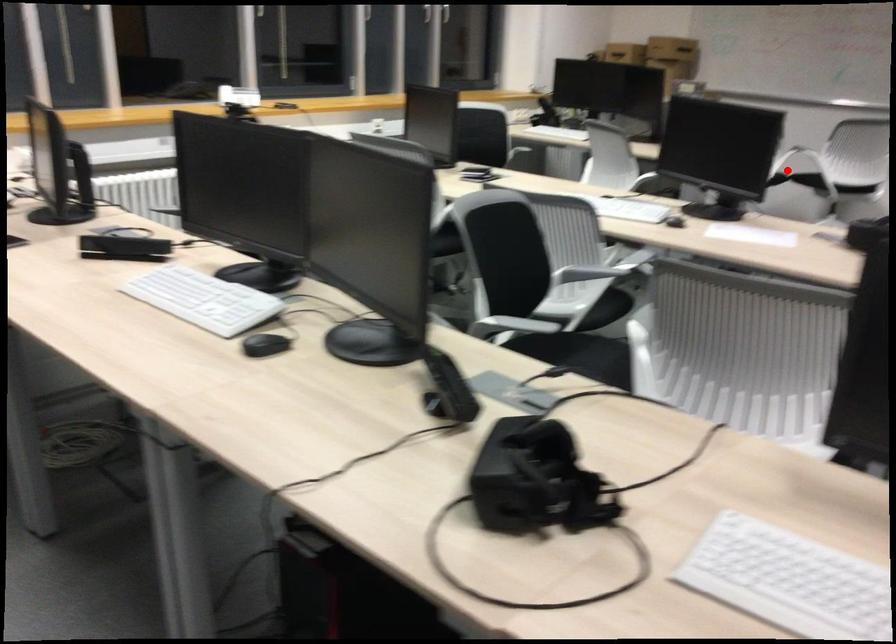
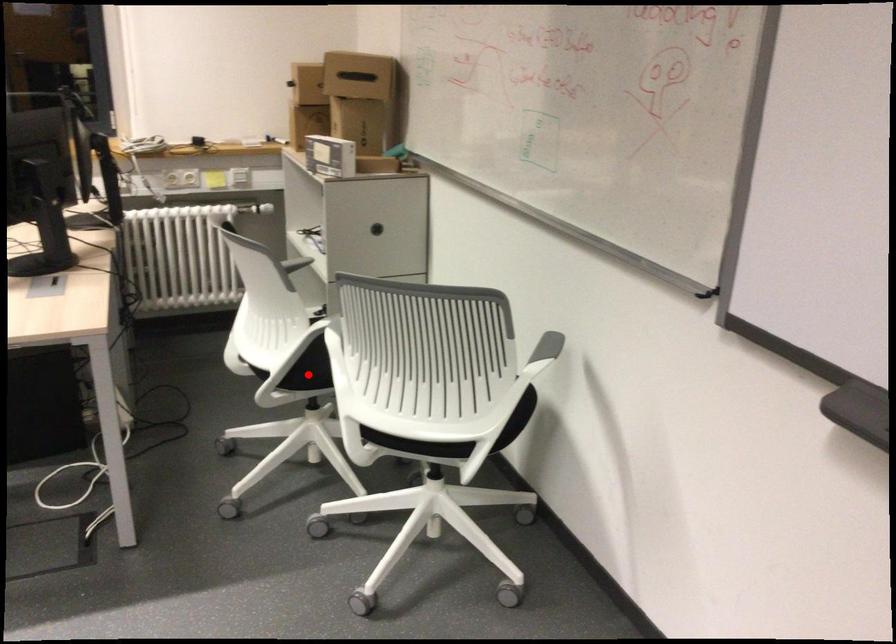
I am providing you with two images of the same scene from different viewpoints. A red point is marked on the first image and another point is marked on the second image. Is the marked point in image1 the same physical position as the marked point in image2?

Yes